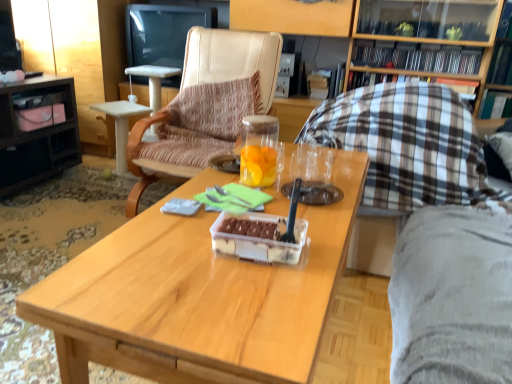
Question: Is hardcover book at center, the 3th book when ordered from front to back, outside wooden coffee table at center?

Choices:
 (A) no
 (B) yes

Answer: (B)

Question: Is wooden coffee table at center at the back of hardcover book at center, the 3th book when ordered from front to back?

Choices:
 (A) no
 (B) yes

Answer: (A)

Question: Is hardcover book at center, the first book positioned from the back, wider than wooden coffee table at center?

Choices:
 (A) no
 (B) yes

Answer: (A)

Question: From a real-world perspective, is hardcover book at center, the first book positioned from the back, positioned under wooden coffee table at center based on gravity?

Choices:
 (A) no
 (B) yes

Answer: (A)

Question: Considering the relative sizes of hardcover book at center, the first book positioned from the back, and wooden coffee table at center in the image provided, is hardcover book at center, the first book positioned from the back, taller than wooden coffee table at center?

Choices:
 (A) no
 (B) yes

Answer: (A)

Question: From the image's perspective, does hardcover book at center, the first book positioned from the back, appear higher than wooden coffee table at center?

Choices:
 (A) yes
 (B) no

Answer: (A)

Question: From a real-world perspective, is black glossy television at upper center under black plastic books at upper right, which appears as the second book when viewed from the back?

Choices:
 (A) no
 (B) yes

Answer: (B)

Question: Is black glossy television at upper center further to camera compared to black plastic books at upper right, which appears as the second book when viewed from the back?

Choices:
 (A) yes
 (B) no

Answer: (A)

Question: From a real-world perspective, is black glossy television at upper center on top of black plastic books at upper right, marked as the 2th book in a front-to-back arrangement?

Choices:
 (A) yes
 (B) no

Answer: (B)

Question: Does black glossy television at upper center have a smaller size compared to black plastic books at upper right, which appears as the second book when viewed from the back?

Choices:
 (A) no
 (B) yes

Answer: (A)

Question: Is black plastic books at upper right, which appears as the second book when viewed from the back, at the back of black glossy television at upper center?

Choices:
 (A) yes
 (B) no

Answer: (B)

Question: From the image's perspective, would you say black glossy television at upper center is positioned over black plastic books at upper right, marked as the 2th book in a front-to-back arrangement?

Choices:
 (A) no
 (B) yes

Answer: (B)

Question: Considering the relative positions of black glossy television at upper center and wooden coffee table at center in the image provided, is black glossy television at upper center to the left of wooden coffee table at center from the viewer's perspective?

Choices:
 (A) yes
 (B) no

Answer: (A)